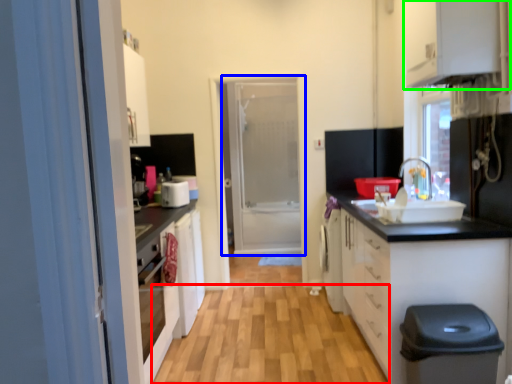
Question: Based on their relative distances, which object is farther from plain (highlighted by a red box)? Choose from door (highlighted by a blue box) and cabinetry (highlighted by a green box).

Choices:
 (A) door
 (B) cabinetry

Answer: (A)